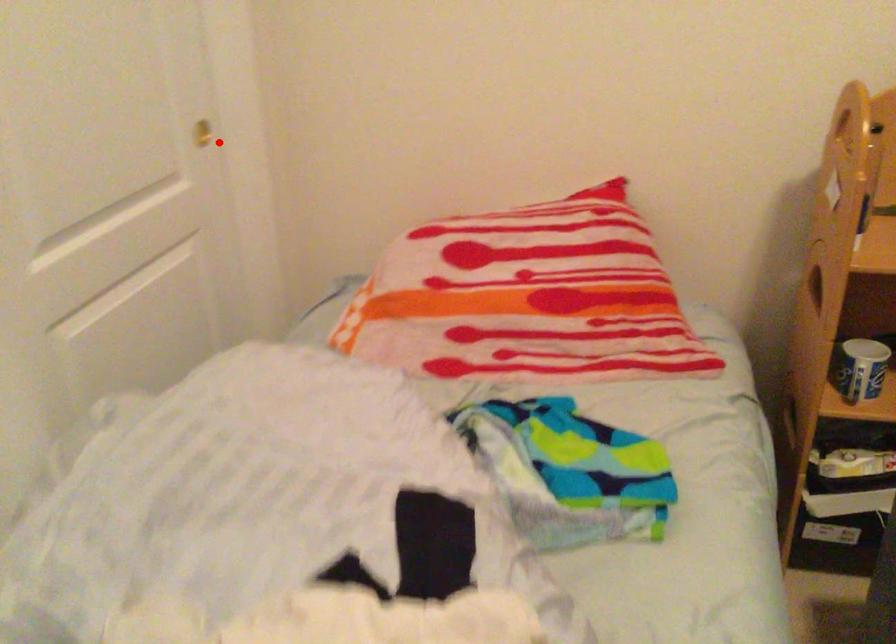
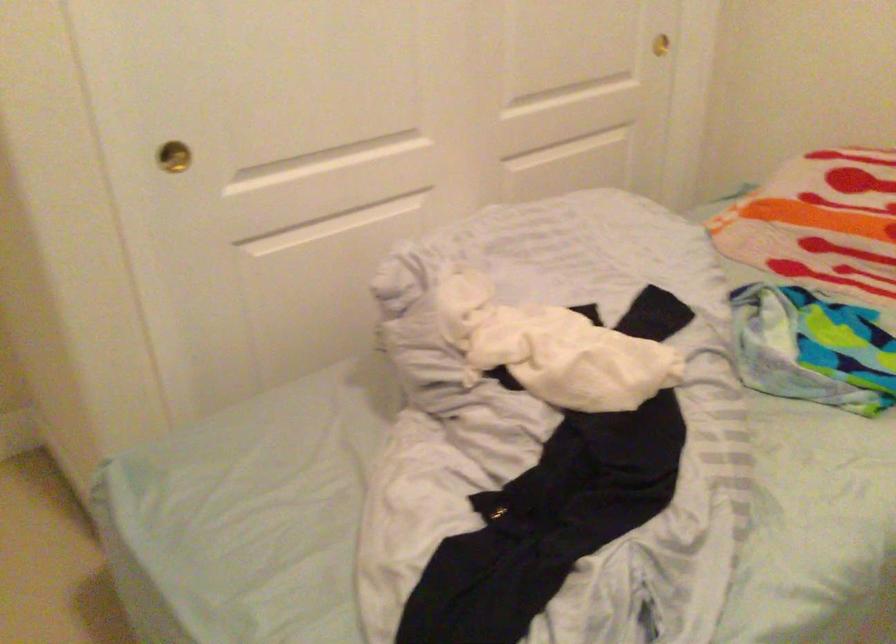
Question: I am providing you with two images of the same scene from different viewpoints. A red point is shown in image1. For the corresponding object point in image2, is it positioned nearer or farther from the camera?

Choices:
 (A) Nearer
 (B) Farther

Answer: (B)